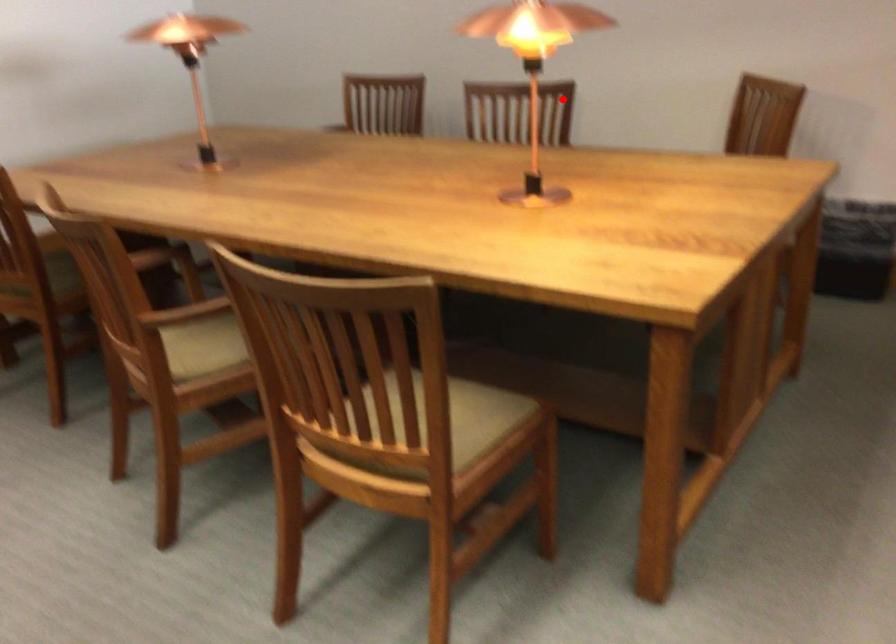
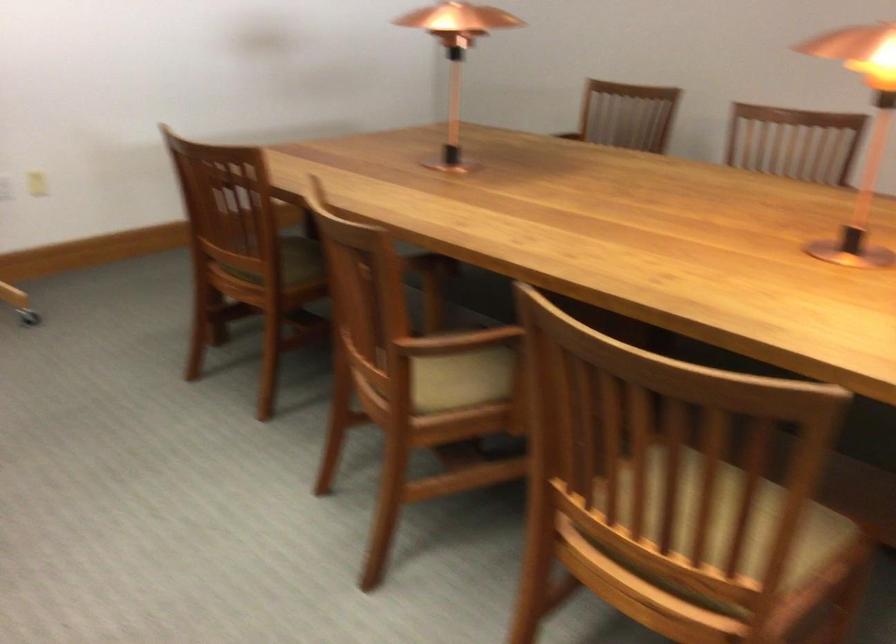
In the second image, find the point that corresponds to the highlighted location in the first image.

(860, 131)